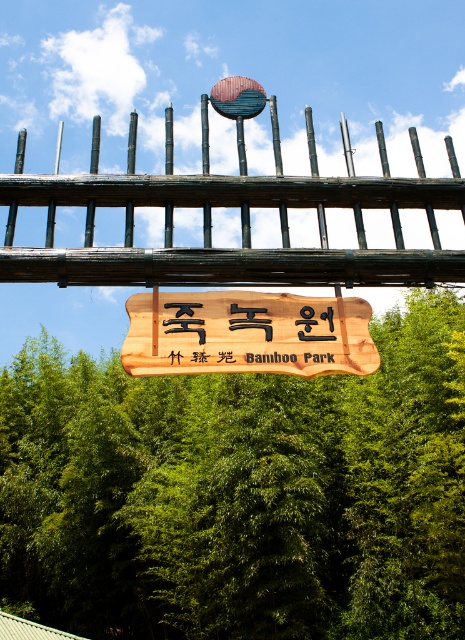
You are planning to install a new pathway in the park entrance. The pathway needs to be 30 meters long to accommodate visitors comfortably. Given the distance between the green leafy tree at center and the weathered wood fence at upper center, will the proposed pathway fit between them?

Result: The distance between the green leafy tree at center and the weathered wood fence at upper center is 28.51 meters. Since the proposed pathway is 30 meters long, it will not fit between them as the available space is shorter than the required length.

You are standing at the entrance of Bamboo Park and want to take a photo of the wooden signboard with the green leafy tree at center in the background. Based on their positions, will the tree be partially or fully visible in the photo?

The green leafy tree at center is located at point (239, 493), so it will be partially visible in the photo.

You are planning to hang a new decorative element between the weathered wood fence at upper center and the wooden sign at center. Given their widths, which object would you place the decoration closer to?

The weathered wood fence at upper center has a lesser width compared to the wooden sign at center, so you should place the decoration closer to the weathered wood fence at upper center to maintain balance.